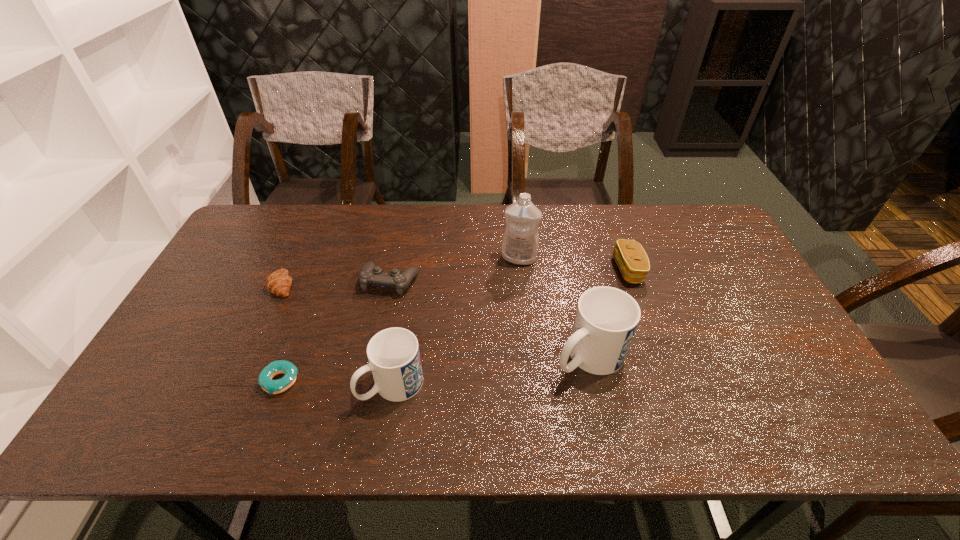
The image size is (960, 540). I want to click on vacant area between the third shortest object and the third object from right to left, so click(x=455, y=269).

Where is `free space between the tallest object and the leftmost object`? This screenshot has height=540, width=960. free space between the tallest object and the leftmost object is located at coordinates (400, 272).

Where is `free area in between the fourth shortest object and the left mug`? Image resolution: width=960 pixels, height=540 pixels. free area in between the fourth shortest object and the left mug is located at coordinates (510, 327).

At what (x,y) coordinates should I click in order to perform the action: click on vacant point located between the detergent and the clutch bag. Please return your answer as a coordinate pair (x, y). The width and height of the screenshot is (960, 540). Looking at the image, I should click on (574, 264).

I want to click on vacant area that lies between the control and the shortest object, so click(x=335, y=331).

The width and height of the screenshot is (960, 540). I want to click on vacant space that's between the crescent roll and the doughnut, so click(x=281, y=333).

Locate an element on the screen. The width and height of the screenshot is (960, 540). free point between the tallest object and the clutch bag is located at coordinates (574, 264).

I want to click on free spot between the detergent and the doughnut, so click(399, 320).

What are the coordinates of `the second closest object to the clutch bag` in the screenshot? It's located at (520, 242).

At what (x,y) coordinates should I click in order to perform the action: click on object that is the third closest one to the second shortest object. Please return your answer as a coordinate pair (x, y). This screenshot has width=960, height=540. Looking at the image, I should click on (394, 359).